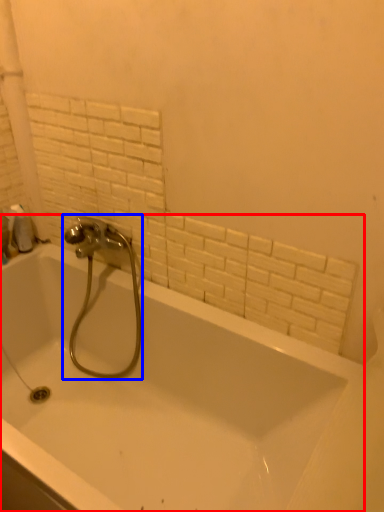
Question: Which point is closer to the camera, bathtub (highlighted by a red box) or tap (highlighted by a blue box)?

Choices:
 (A) bathtub
 (B) tap

Answer: (A)